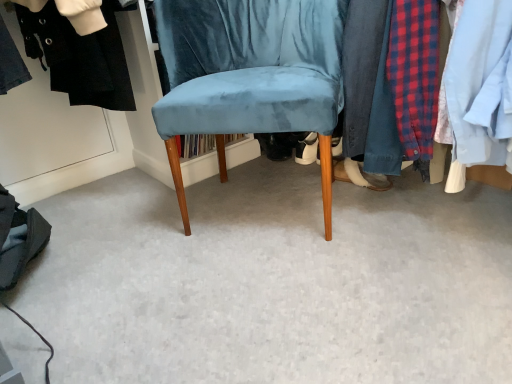
Where is `vacant space to the right of velvet blue chair at center`? The image size is (512, 384). vacant space to the right of velvet blue chair at center is located at coordinates (417, 216).